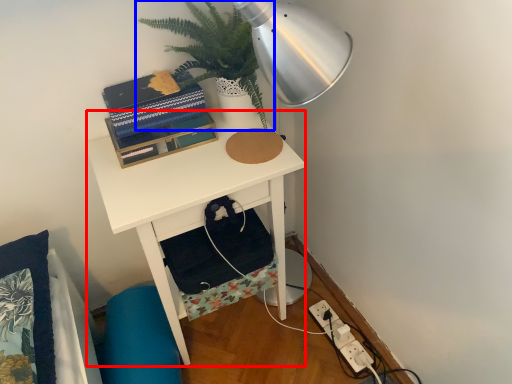
Question: Which object appears farthest to the camera in this image, desk (highlighted by a red box) or houseplant (highlighted by a blue box)?

Choices:
 (A) desk
 (B) houseplant

Answer: (A)